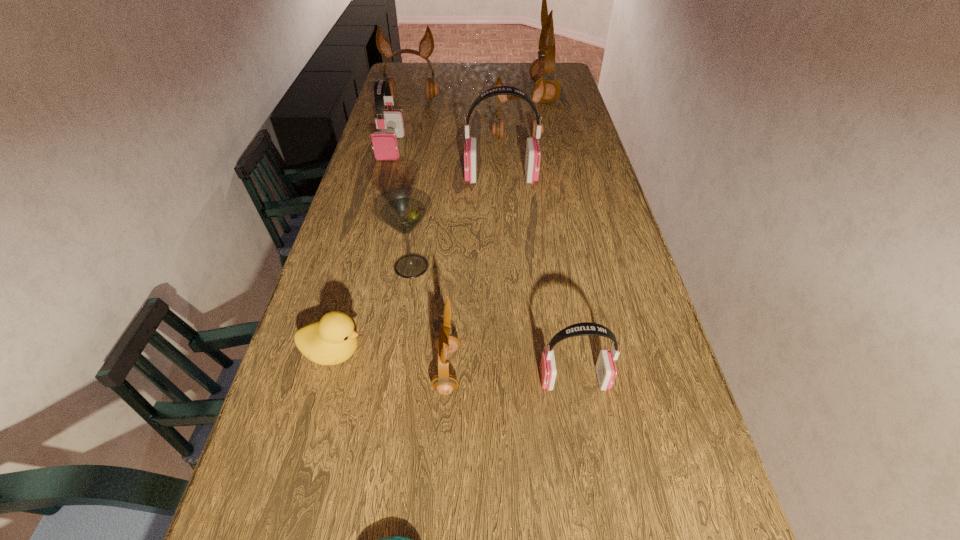
In order to click on the sixth closest object relative to the smallest pink earphone in this screenshot , I will do `click(385, 144)`.

At what (x,y) coordinates should I click in order to perform the action: click on the fourth closest object relative to the smallest pink earphone. Please return your answer as a coordinate pair (x, y). Image resolution: width=960 pixels, height=540 pixels. Looking at the image, I should click on (332, 340).

Identify the location of earphone that can be found as the sixth closest to the nearest object. (426, 46).

Identify which earphone is the sixth closest to the leftmost brown earphone. Please provide its 2D coordinates. Your answer should be formatted as a tuple, i.e. [(x, y)], where the tuple contains the x and y coordinates of a point satisfying the conditions above.

[(606, 370)]

This screenshot has width=960, height=540. I want to click on brown earphone that is the nearest to the leftmost brown earphone, so click(x=539, y=93).

The height and width of the screenshot is (540, 960). I want to click on brown earphone that stands as the second closest to the second biggest brown earphone, so click(x=544, y=65).

Identify which pink earphone is the nearest to the leftmost pink earphone. Please provide its 2D coordinates. Your answer should be formatted as a tuple, i.e. [(x, y)], where the tuple contains the x and y coordinates of a point satisfying the conditions above.

[(533, 153)]

At what (x,y) coordinates should I click in order to perform the action: click on pink earphone that is the second closest to the third biggest brown earphone. Please return your answer as a coordinate pair (x, y). This screenshot has height=540, width=960. Looking at the image, I should click on (385, 144).

Find the location of a particular element. vacant space that satisfies the following two spatial constraints: 1. on the front-facing side of the martini; 2. on the left side of the third smallest brown earphone is located at coordinates (372, 266).

Locate an element on the screen. blank area in the image that satisfies the following two spatial constraints: 1. on the front-facing side of the leftmost brown earphone; 2. on the front-facing side of the duck is located at coordinates (350, 353).